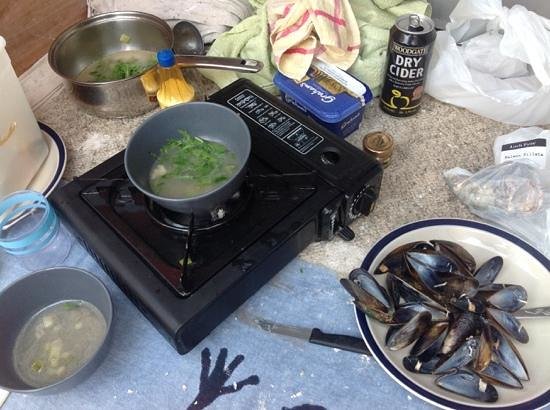
Find the location of `plastic container`. plastic container is located at coordinates (345, 105).